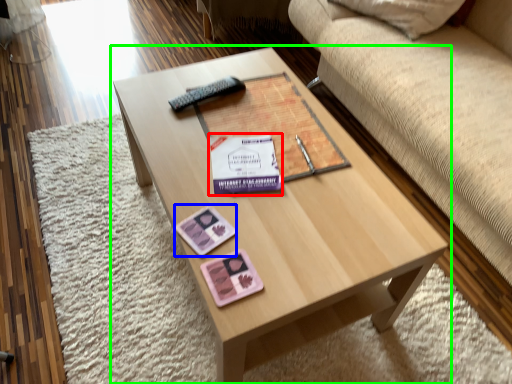
Question: Estimate the real-world distances between objects in this image. Which object is farther from paperback book (highlighted by a red box), currency (highlighted by a blue box) or coffee table (highlighted by a green box)?

Choices:
 (A) currency
 (B) coffee table

Answer: (B)